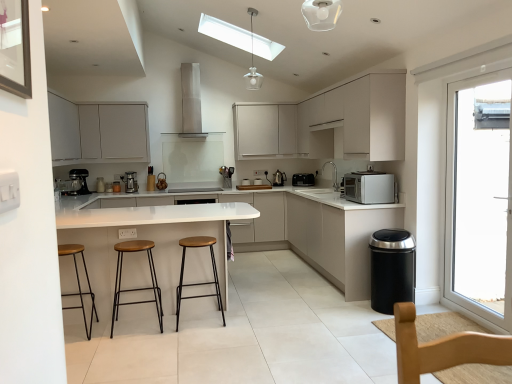
Question: Is white matte microwave at right shorter than satin silver toaster at center, acting as the 1th appliance starting from the right?

Choices:
 (A) yes
 (B) no

Answer: (B)

Question: From a real-world perspective, is white matte microwave at right located higher than satin silver toaster at center, acting as the 1th appliance starting from the right?

Choices:
 (A) no
 (B) yes

Answer: (B)

Question: Would you say white matte microwave at right contains satin silver toaster at center, which ranks as the 2th appliance in left-to-right order?

Choices:
 (A) yes
 (B) no

Answer: (B)

Question: Does white matte microwave at right have a larger size compared to satin silver toaster at center, acting as the 1th appliance starting from the right?

Choices:
 (A) yes
 (B) no

Answer: (A)

Question: From the image's perspective, is white matte microwave at right below satin silver toaster at center, which ranks as the 2th appliance in left-to-right order?

Choices:
 (A) no
 (B) yes

Answer: (B)

Question: Is point (356, 274) closer or farther from the camera than point (108, 208)?

Choices:
 (A) farther
 (B) closer

Answer: (B)

Question: From the image's perspective, relative to white glossy table at center, is white glossy countertop at center above or below?

Choices:
 (A) above
 (B) below

Answer: (A)

Question: In terms of width, does white glossy countertop at center look wider or thinner when compared to white glossy table at center?

Choices:
 (A) wide
 (B) thin

Answer: (A)

Question: Is white glossy countertop at center inside the boundaries of white glossy table at center, or outside?

Choices:
 (A) outside
 (B) inside

Answer: (A)

Question: Considering the positions of white matte cabinet at upper center, the second cabinetry from the right, and matte white cabinet at upper center, which appears as the 3th cabinetry when viewed from the left, in the image, is white matte cabinet at upper center, the second cabinetry from the right, taller or shorter than matte white cabinet at upper center, which appears as the 3th cabinetry when viewed from the left,?

Choices:
 (A) tall
 (B) short

Answer: (A)

Question: Does point (283, 127) appear closer or farther from the camera than point (282, 110)?

Choices:
 (A) closer
 (B) farther

Answer: (B)

Question: Do you think white matte cabinet at upper center, the second cabinetry from the right, is within matte white cabinet at upper center, which appears as the 3th cabinetry when viewed from the left, or outside of it?

Choices:
 (A) inside
 (B) outside

Answer: (B)

Question: Is white matte cabinet at upper center, marked as the fourth cabinetry in a left-to-right arrangement, in front of or behind matte white cabinet at upper center, which appears as the 3th cabinetry when viewed from the left, in the image?

Choices:
 (A) behind
 (B) front

Answer: (B)

Question: Considering the positions of polished stainless steel kettle at center-right, the 1th appliance from the left, and wooden seat metal frame stool at left, which is the third stool in right-to-left order, in the image, is polished stainless steel kettle at center-right, the 1th appliance from the left, wider or thinner than wooden seat metal frame stool at left, which is the third stool in right-to-left order,?

Choices:
 (A) thin
 (B) wide

Answer: (A)

Question: Based on their sizes in the image, would you say polished stainless steel kettle at center-right, the second appliance from the right, is bigger or smaller than wooden seat metal frame stool at left, which is the third stool in right-to-left order?

Choices:
 (A) big
 (B) small

Answer: (B)